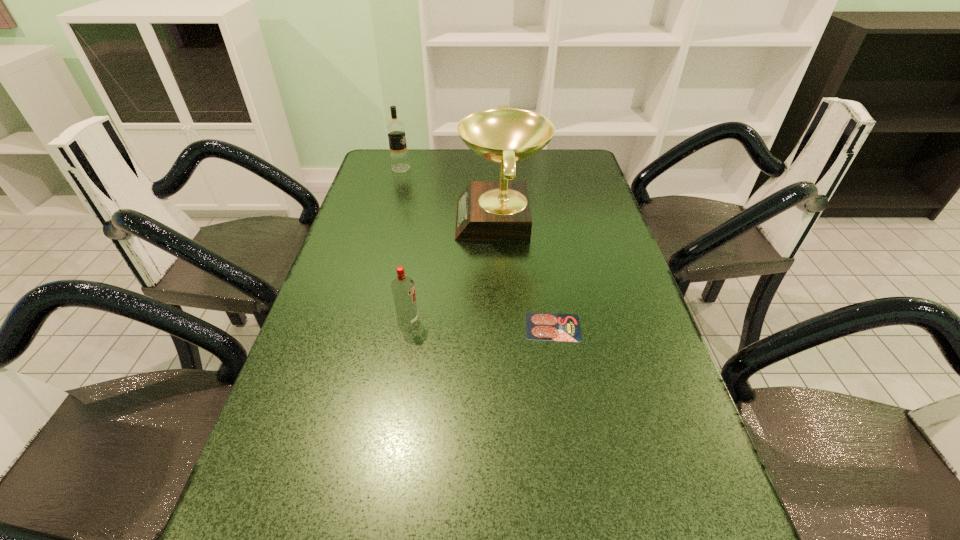
Find the location of a particular element. free space that is in between the third shortest object and the nearer vodka is located at coordinates (404, 245).

Where is `vacant space that's between the shortest object and the award`? The width and height of the screenshot is (960, 540). vacant space that's between the shortest object and the award is located at coordinates (527, 273).

Find the location of a particular element. vacant space in between the shortest object and the second farthest object is located at coordinates (527, 273).

Locate an element on the screen. unoccupied position between the salami and the second farthest object is located at coordinates (527, 273).

Locate an element on the screen. empty space between the award and the second object from left to right is located at coordinates (454, 270).

The image size is (960, 540). In order to click on vacant space in between the second farthest object and the taller vodka in this screenshot , I will do click(450, 194).

Locate an element on the screen. empty location between the nearer vodka and the taller vodka is located at coordinates (404, 245).

You are a GUI agent. You are given a task and a screenshot of the screen. Output one action in this format:
    pyautogui.click(x=<x>, y=<y>)
    Task: Click on the free point between the tallest object and the shortest object
    The width and height of the screenshot is (960, 540).
    Given the screenshot: What is the action you would take?
    pyautogui.click(x=527, y=273)

The height and width of the screenshot is (540, 960). I want to click on vacant area between the second shortest object and the shortest object, so click(481, 323).

Locate an element on the screen. This screenshot has width=960, height=540. vacant space that is in between the shortest object and the nearer vodka is located at coordinates (481, 323).